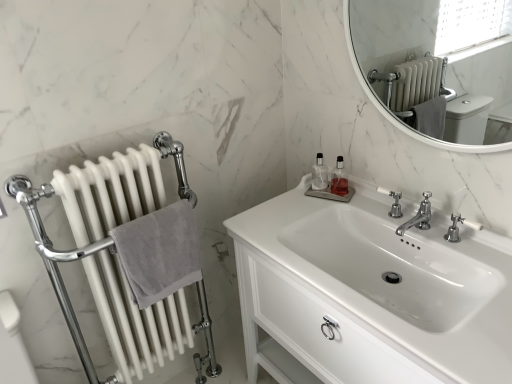
In order to click on free space in front of polished chrome faucet at upper right in this screenshot , I will do `click(408, 232)`.